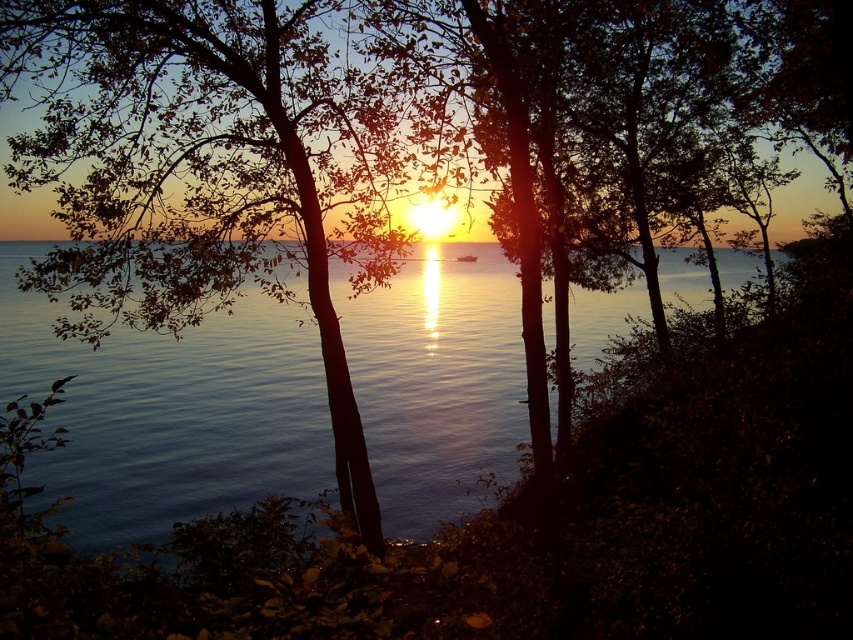
Question: Which object is farther from the camera taking this photo?

Choices:
 (A) green leafy tree at center
 (B) glistening blue water at center

Answer: (B)

Question: Which of the following is the farthest from the observer?

Choices:
 (A) (398, 112)
 (B) (368, 426)

Answer: (B)

Question: Does green leafy tree at center appear on the left side of glistening blue water at center?

Choices:
 (A) yes
 (B) no

Answer: (A)

Question: Does green leafy tree at center have a lesser width compared to glistening blue water at center?

Choices:
 (A) yes
 (B) no

Answer: (A)

Question: Among these points, which one is nearest to the camera?

Choices:
 (A) (169, 474)
 (B) (328, 106)

Answer: (B)

Question: Does green leafy tree at center appear on the right side of glistening blue water at center?

Choices:
 (A) no
 (B) yes

Answer: (A)